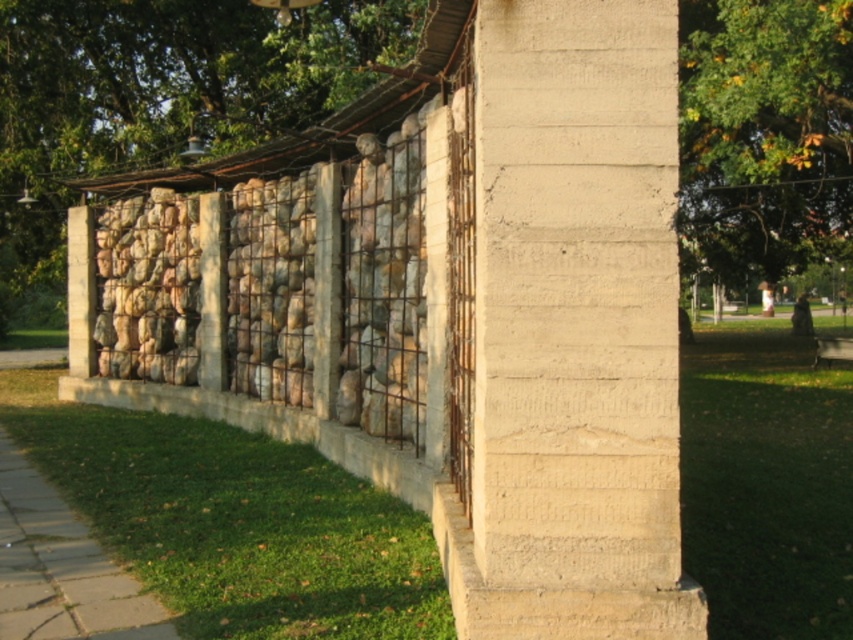
You are standing in front of the wall described in the scene. You notice both the smooth concrete pillar at center and the natural stone wall at center. Which of these two objects is positioned lower in the image?

The smooth concrete pillar at center is positioned lower than the natural stone wall at center because it is located below it.